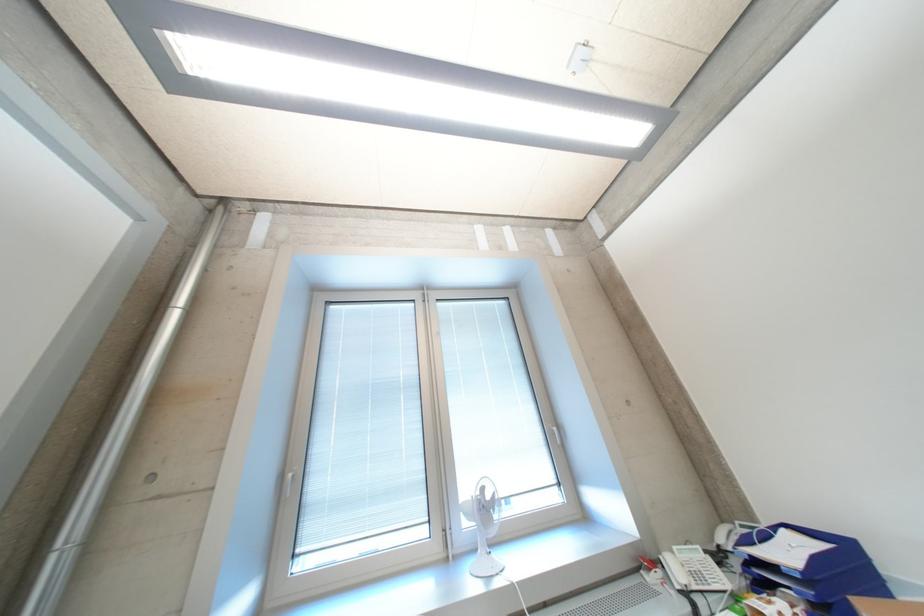
The height and width of the screenshot is (616, 924). I want to click on white window handle, so click(x=568, y=450).